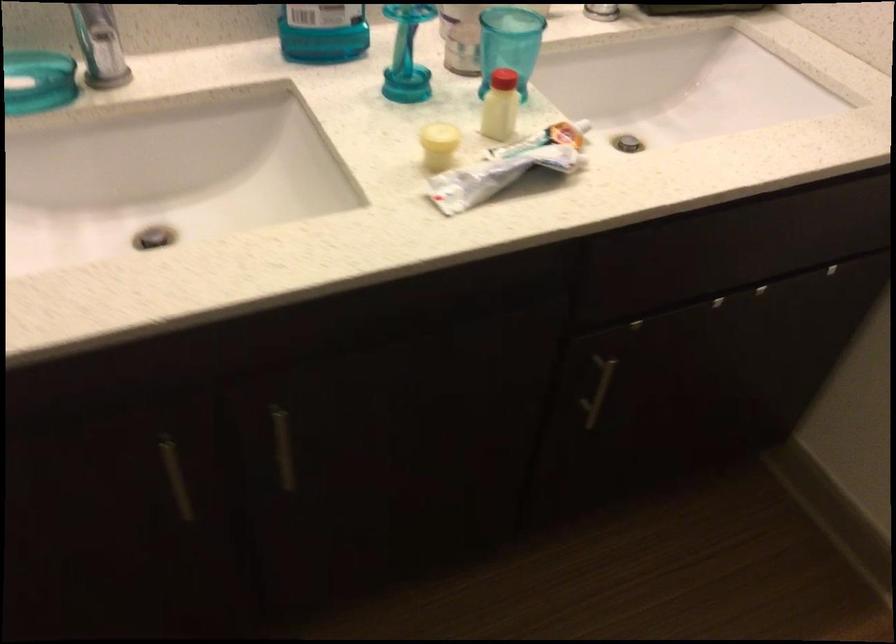
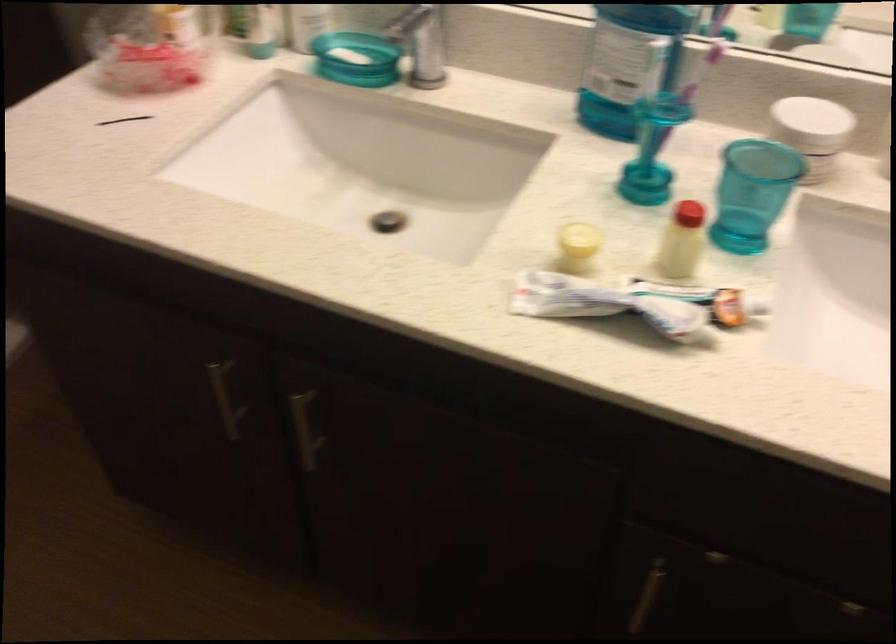
Question: The camera is either moving clockwise (left) or counter-clockwise (right) around the object. The first image is from the beginning of the video and the second image is from the end. Is the camera moving left or right when shooting the video?

Choices:
 (A) Left
 (B) Right

Answer: (B)